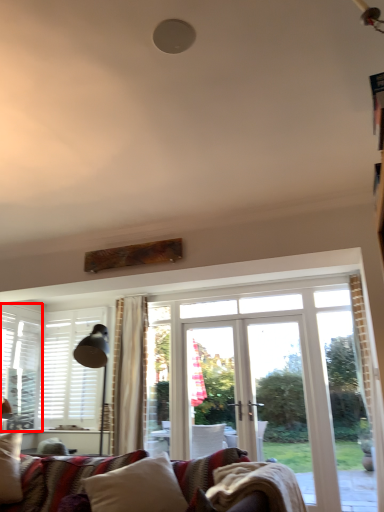
Question: In this image, where is window (annotated by the red box) located relative to pillow?

Choices:
 (A) right
 (B) left

Answer: (B)